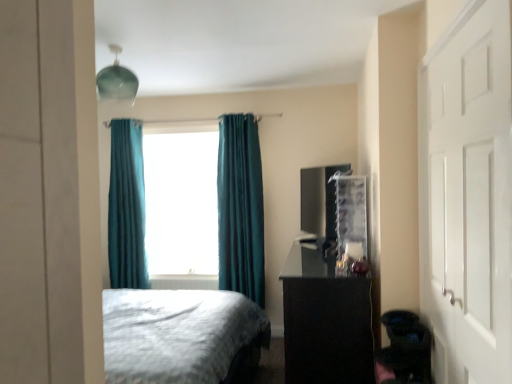
Question: Can you confirm if teal velvet curtain at center, the second curtain viewed from the right, is positioned to the left of teal fabric curtain at center?

Choices:
 (A) yes
 (B) no

Answer: (A)

Question: Is teal velvet curtain at center, the second curtain viewed from the right, positioned before teal fabric curtain at center?

Choices:
 (A) yes
 (B) no

Answer: (A)

Question: Is teal velvet curtain at center, the 1th curtain in the left-to-right sequence, shorter than teal fabric curtain at center?

Choices:
 (A) no
 (B) yes

Answer: (A)

Question: Considering the relative positions of teal velvet curtain at center, the second curtain viewed from the right, and teal fabric curtain at center in the image provided, is teal velvet curtain at center, the second curtain viewed from the right, behind teal fabric curtain at center?

Choices:
 (A) yes
 (B) no

Answer: (B)

Question: Is teal velvet curtain at center, the second curtain viewed from the right, wider than teal fabric curtain at center?

Choices:
 (A) no
 (B) yes

Answer: (A)

Question: From the image's perspective, is teal velvet curtain at center, which ranks as the 1th curtain in right-to-left order, located above or below black glossy vanity at right?

Choices:
 (A) below
 (B) above

Answer: (B)

Question: Is teal velvet curtain at center, positioned as the 2th curtain in left-to-right order, bigger or smaller than black glossy vanity at right?

Choices:
 (A) small
 (B) big

Answer: (A)

Question: Is teal velvet curtain at center, positioned as the 2th curtain in left-to-right order, to the left or to the right of black glossy vanity at right in the image?

Choices:
 (A) right
 (B) left

Answer: (B)

Question: Do you think teal velvet curtain at center, positioned as the 2th curtain in left-to-right order, is within black glossy vanity at right, or outside of it?

Choices:
 (A) inside
 (B) outside

Answer: (B)

Question: Would you say teal fabric curtain at center is to the left or to the right of black glossy vanity at right in the picture?

Choices:
 (A) right
 (B) left

Answer: (B)

Question: Considering their positions, is teal fabric curtain at center located in front of or behind black glossy vanity at right?

Choices:
 (A) behind
 (B) front

Answer: (A)

Question: Considering the positions of point (148, 256) and point (313, 349), is point (148, 256) closer or farther from the camera than point (313, 349)?

Choices:
 (A) closer
 (B) farther

Answer: (B)

Question: From their relative heights in the image, would you say teal fabric curtain at center is taller or shorter than black glossy vanity at right?

Choices:
 (A) short
 (B) tall

Answer: (B)

Question: Is teal fabric curtain at center wider or thinner than teal velvet curtain at center, the 1th curtain in the left-to-right sequence?

Choices:
 (A) wide
 (B) thin

Answer: (A)

Question: Based on their sizes in the image, would you say teal fabric curtain at center is bigger or smaller than teal velvet curtain at center, the 1th curtain in the left-to-right sequence?

Choices:
 (A) small
 (B) big

Answer: (B)